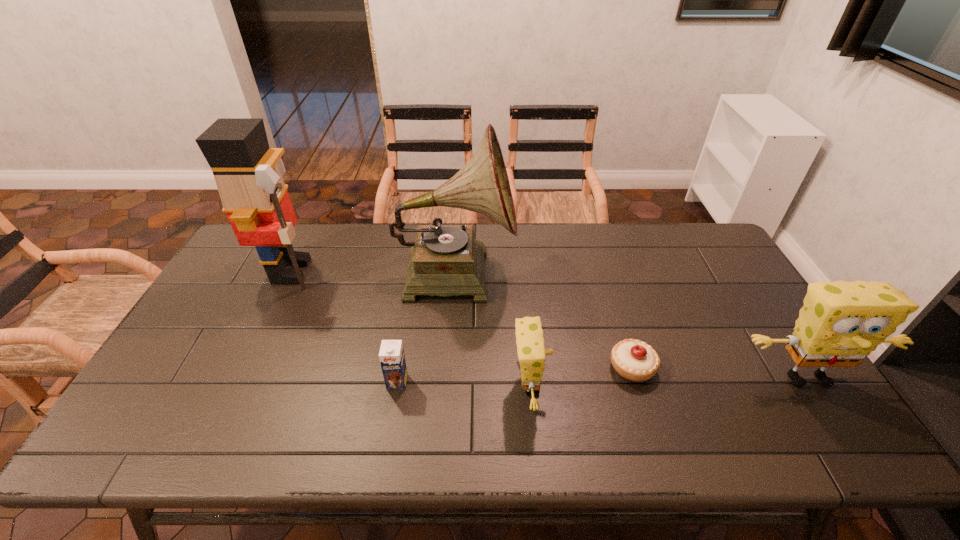
The width and height of the screenshot is (960, 540). In order to click on object that is positioned at the far left corner in this screenshot , I will do `click(255, 198)`.

This screenshot has width=960, height=540. What are the coordinates of `object at the near right corner` in the screenshot? It's located at (841, 323).

This screenshot has width=960, height=540. What are the coordinates of `free space at the far edge of the desktop` in the screenshot? It's located at (493, 251).

Image resolution: width=960 pixels, height=540 pixels. In the image, there is a desktop. Find the location of `vacant space at the near edge`. vacant space at the near edge is located at coordinates (716, 390).

I want to click on vacant space at the left edge of the desktop, so click(164, 363).

Identify the location of vacant space at the right edge of the desktop. The height and width of the screenshot is (540, 960). (687, 276).

At what (x,y) coordinates should I click in order to perform the action: click on vacant space at the far left corner. Please return your answer as a coordinate pair (x, y). This screenshot has height=540, width=960. Looking at the image, I should click on (247, 251).

You are a GUI agent. You are given a task and a screenshot of the screen. Output one action in this format:
    pyautogui.click(x=<x>, y=<y>)
    Task: Click on the vacant space at the near left corner
    The width and height of the screenshot is (960, 540).
    Given the screenshot: What is the action you would take?
    pyautogui.click(x=200, y=400)

The height and width of the screenshot is (540, 960). What are the coordinates of `unoccupied position between the record player and the shorter sponge` in the screenshot? It's located at (492, 328).

Where is `empty space between the chocolate milk and the shorter sponge`? Image resolution: width=960 pixels, height=540 pixels. empty space between the chocolate milk and the shorter sponge is located at coordinates (464, 384).